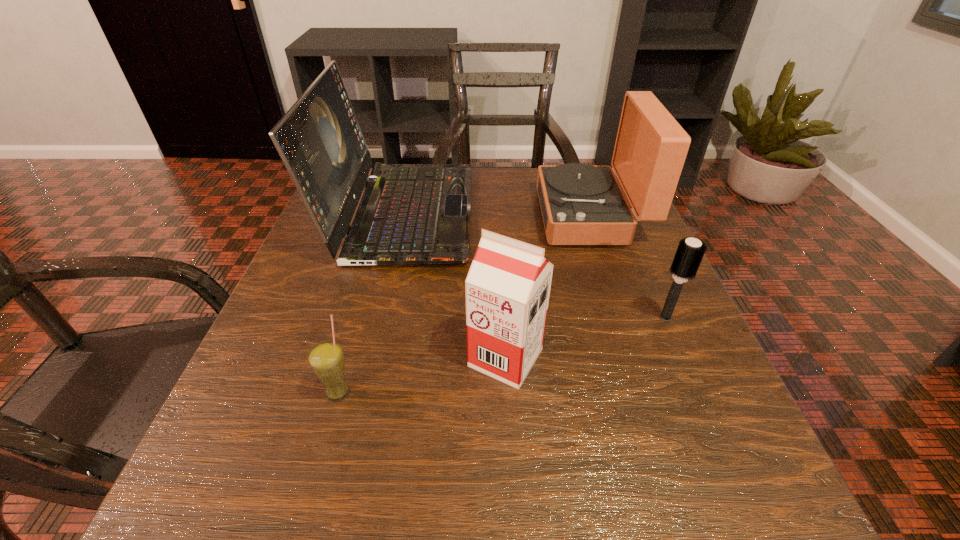
Locate an element on the screen. This screenshot has height=540, width=960. vacant area that lies between the third farthest object and the phonograph record is located at coordinates (628, 266).

Where is `empty space that is in between the soya milk and the straw for drinking`? The height and width of the screenshot is (540, 960). empty space that is in between the soya milk and the straw for drinking is located at coordinates (421, 375).

You are a GUI agent. You are given a task and a screenshot of the screen. Output one action in this format:
    pyautogui.click(x=<x>, y=<y>)
    Task: Click on the empty space that is in between the phonograph record and the shortest object
    
    Given the screenshot: What is the action you would take?
    pyautogui.click(x=465, y=303)

Image resolution: width=960 pixels, height=540 pixels. In order to click on object that is the fourth closest to the shortest object in this screenshot , I will do `click(690, 252)`.

Identify which object is the third closest to the phonograph record. Please provide its 2D coordinates. Your answer should be formatted as a tuple, i.e. [(x, y)], where the tuple contains the x and y coordinates of a point satisfying the conditions above.

[(507, 288)]

Locate an element on the screen. The height and width of the screenshot is (540, 960). free point that satisfies the following two spatial constraints: 1. on the screen of the laptop computer; 2. on the front side of the shortest object is located at coordinates (360, 392).

You are a GUI agent. You are given a task and a screenshot of the screen. Output one action in this format:
    pyautogui.click(x=<x>, y=<y>)
    Task: Click on the vacant region that satisfies the following two spatial constraints: 1. on the face of the phonograph record; 2. on the left side of the hairbrush
    This screenshot has height=540, width=960.
    Given the screenshot: What is the action you would take?
    pyautogui.click(x=626, y=318)

This screenshot has height=540, width=960. Identify the location of blank area in the image that satisfies the following two spatial constraints: 1. on the screen of the soya milk; 2. on the right side of the laptop computer. (368, 357).

Locate an element on the screen. The width and height of the screenshot is (960, 540). vacant region that satisfies the following two spatial constraints: 1. on the screen of the laptop computer; 2. on the left side of the third object from right to left is located at coordinates (368, 357).

Locate an element on the screen. free location that satisfies the following two spatial constraints: 1. on the back side of the third object from left to right; 2. on the right side of the third farthest object is located at coordinates (503, 318).